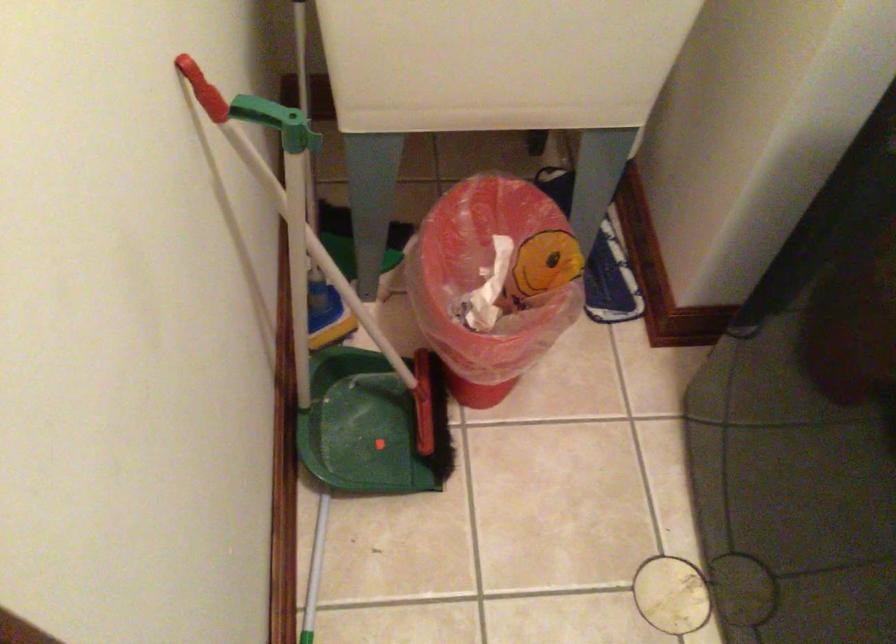
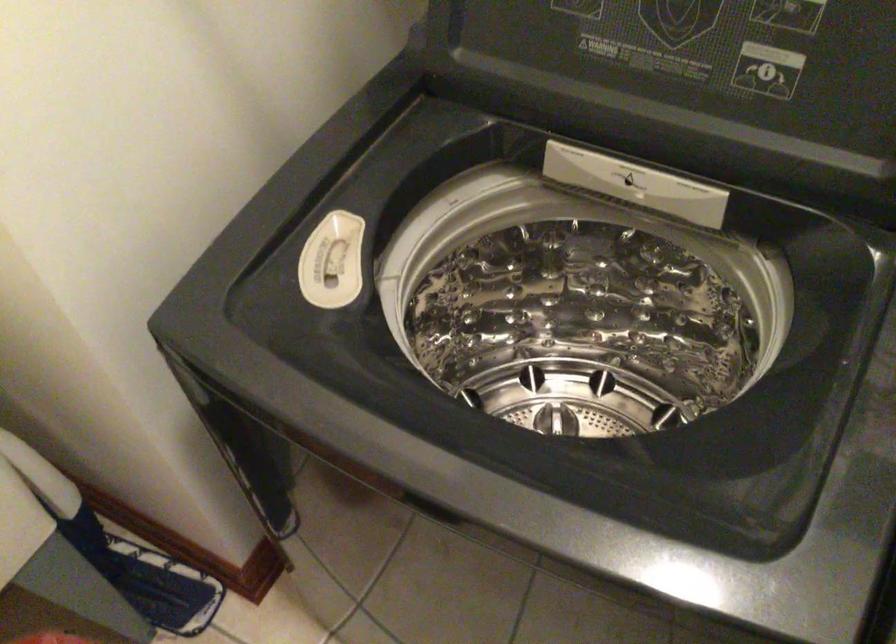
Question: How did the camera likely rotate?

Choices:
 (A) Left
 (B) Right
 (C) Up
 (D) Down

Answer: (B)